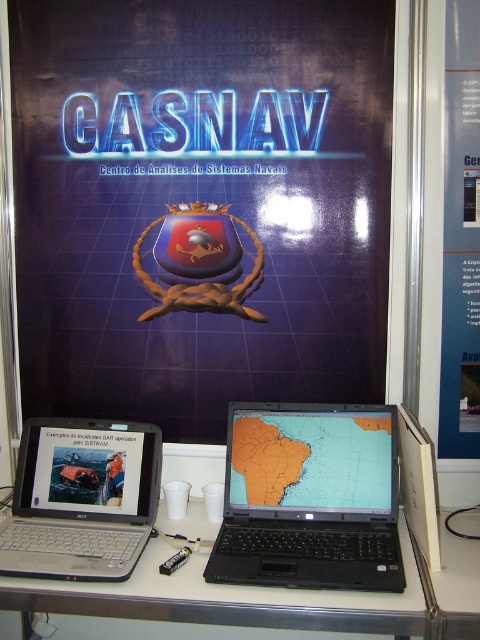
Consider the image. Between silver metallic laptop at center and orange matte map at center, which one has less height?

Standing shorter between the two is orange matte map at center.

Does silver metallic laptop at center have a lesser width compared to orange matte map at center?

Yes, silver metallic laptop at center is thinner than orange matte map at center.

Locate an element on the screen. Image resolution: width=480 pixels, height=640 pixels. silver metallic laptop at center is located at coordinates (82, 499).

Image resolution: width=480 pixels, height=640 pixels. I want to click on silver metallic laptop at center, so [x=82, y=499].

From the picture: How far apart are silver metallic computer desk at center and orange matte map at center?

silver metallic computer desk at center is 10.78 inches from orange matte map at center.

Between point (159, 563) and point (313, 502), which one is positioned in front?

Point (159, 563) is in front.

The width and height of the screenshot is (480, 640). I want to click on silver metallic computer desk at center, so click(224, 598).

Between black plastic laptop at center and blue glossy poster at upper center, which one is positioned lower?

black plastic laptop at center

Can you confirm if black plastic laptop at center is positioned to the right of blue glossy poster at upper center?

Incorrect, black plastic laptop at center is not on the right side of blue glossy poster at upper center.

Is point (384, 419) farther from viewer compared to point (456, 422)?

No.

In order to click on black plastic laptop at center in this screenshot , I will do `click(310, 499)`.